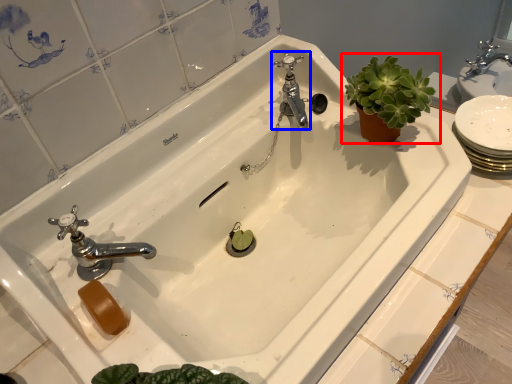
Question: Which of the following is the closest to the observer, houseplant (highlighted by a red box) or tap (highlighted by a blue box)?

Choices:
 (A) houseplant
 (B) tap

Answer: (A)